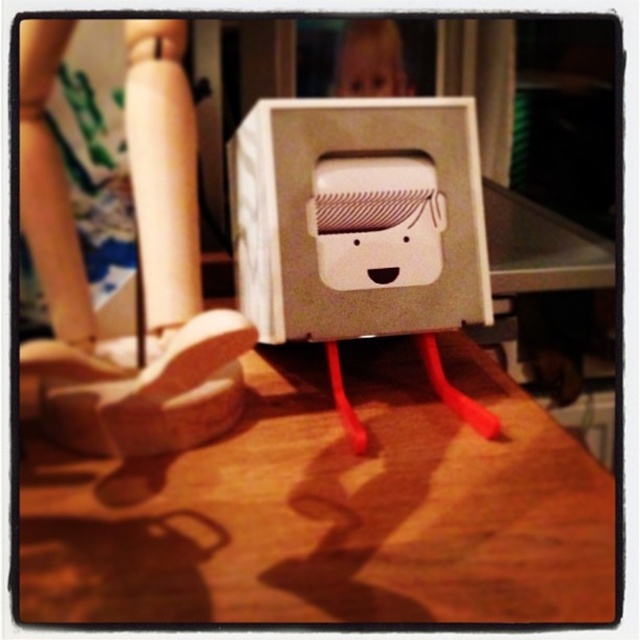
Is matte plastic doll at lower left below matte plastic face at upper center?

Yes.

Does matte plastic doll at lower left have a lesser height compared to matte plastic face at upper center?

Incorrect, matte plastic doll at lower left's height does not fall short of matte plastic face at upper center's.

Which is behind, point (216, 310) or point (342, 61)?

The point (216, 310) is behind.

Locate an element on the screen. matte plastic doll at lower left is located at coordinates tap(118, 240).

Who is more forward, (129, 481) or (170, 120)?

Positioned in front is point (129, 481).

Between wooden table at lower center and matte plastic doll at lower left, which one has more height?

matte plastic doll at lower left is taller.

Between point (262, 465) and point (150, 131), which one is positioned in front?

Point (262, 465) is more forward.

Find the location of a particular element. This screenshot has height=640, width=640. wooden table at lower center is located at coordinates (330, 508).

Does wooden table at lower center have a lesser height compared to matte plastic face at upper center?

No.

Can you confirm if wooden table at lower center is positioned to the left of matte plastic face at upper center?

Correct, you'll find wooden table at lower center to the left of matte plastic face at upper center.

Which is behind, point (84, 589) or point (387, 51)?

Point (387, 51)

This screenshot has height=640, width=640. What are the coordinates of `wooden table at lower center` in the screenshot? It's located at (330, 508).